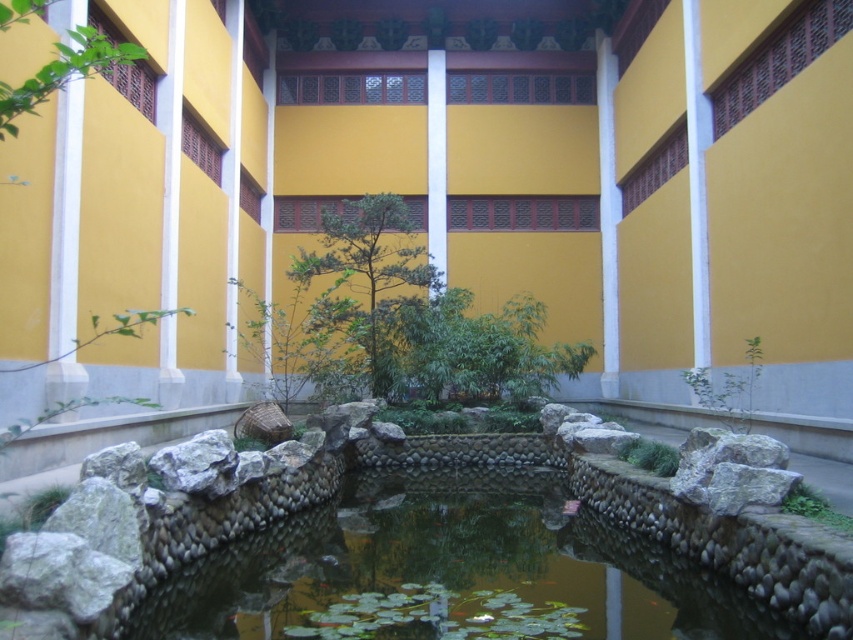
Does clear stone water at center have a greater width compared to green matte tree at center?

Indeed, clear stone water at center has a greater width compared to green matte tree at center.

Who is higher up, clear stone water at center or green matte tree at center?

green matte tree at center is above.

Is point (387, 620) more distant than point (361, 291)?

No, it is in front of (361, 291).

Where is `clear stone water at center`? This screenshot has width=853, height=640. clear stone water at center is located at coordinates (450, 570).

Can you confirm if green matte tree at center is smaller than green leafy tree at upper left?

Actually, green matte tree at center might be larger than green leafy tree at upper left.

Measure the distance between green matte tree at center and green leafy tree at upper left.

green matte tree at center is 11.83 meters away from green leafy tree at upper left.

Is point (386, 220) more distant than point (3, 131)?

Yes, point (386, 220) is farther from viewer.

This screenshot has height=640, width=853. I want to click on green matte tree at center, so pyautogui.click(x=372, y=278).

Does clear stone water at center appear under green leafy tree at upper left?

Yes, clear stone water at center is below green leafy tree at upper left.

Between point (471, 490) and point (4, 26), which one is positioned behind?

The point (471, 490) is more distant.

At what (x,y) coordinates should I click in order to perform the action: click on clear stone water at center. Please return your answer as a coordinate pair (x, y). This screenshot has width=853, height=640. Looking at the image, I should click on (450, 570).

The width and height of the screenshot is (853, 640). Find the location of `clear stone water at center`. clear stone water at center is located at coordinates (450, 570).